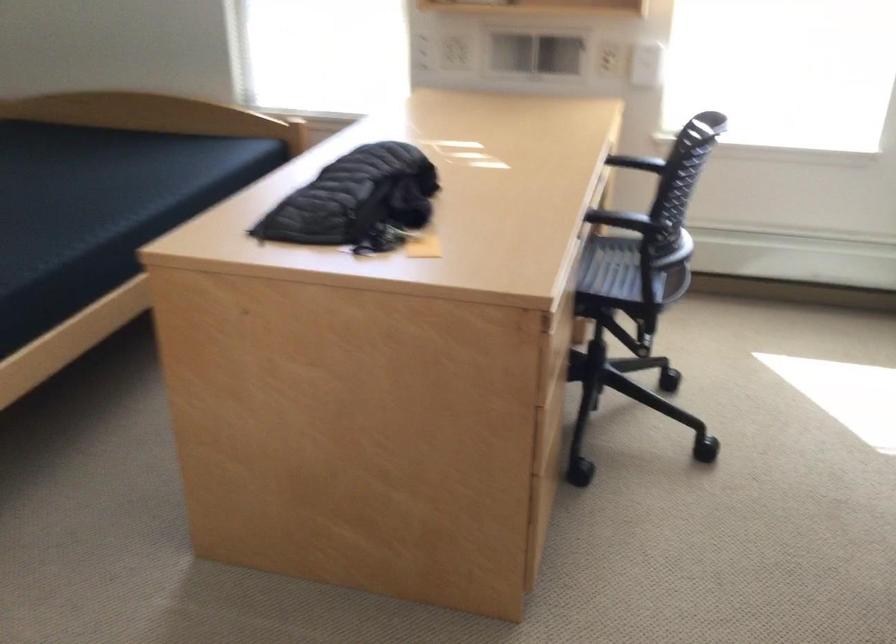
This screenshot has width=896, height=644. Find the location of `white light switch`. white light switch is located at coordinates (616, 62).